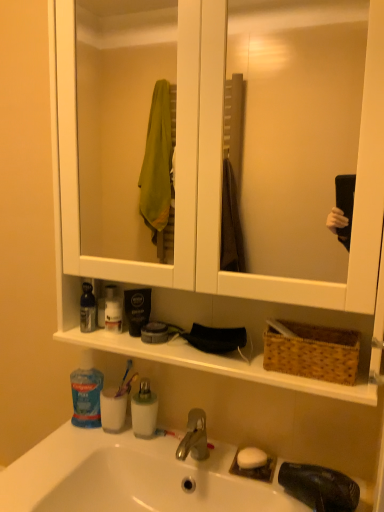
I want to click on free space on the front side of blue plastic toothpaste at lower left, the first toiletry positioned from the bottom, so click(65, 453).